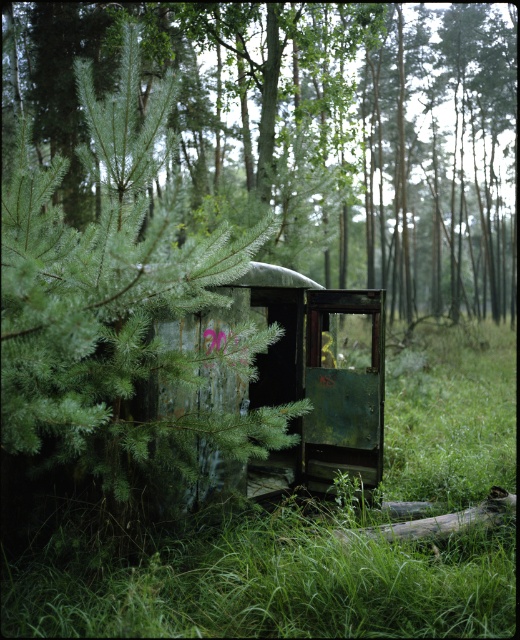
You are a hiker who wants to take a photo of the green matte tree at center and the green grassy at center. Which object should you focus on first if you want to capture both in the same frame without moving the camera?

The green matte tree at center is much taller than the green grassy at center, so you should focus on the green matte tree at center first to ensure it fits in the frame.

You are a hiker who wants to take a photo of the green matte tree at center and the green weathered train car at center. Which object should you focus on first if you want both to be in the same frame without moving your camera?

The green matte tree at center is bigger than the green weathered train car at center, so you should focus on the green weathered train car at center first to ensure both fit in the frame.